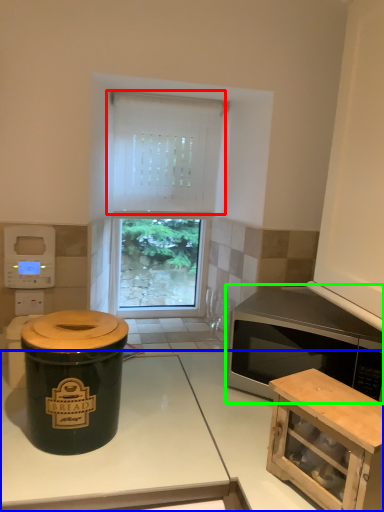
Question: Which object is the closest to the curtain (highlighted by a red box)? Choose among these: countertop (highlighted by a blue box) or microwave oven (highlighted by a green box).

Choices:
 (A) countertop
 (B) microwave oven

Answer: (B)